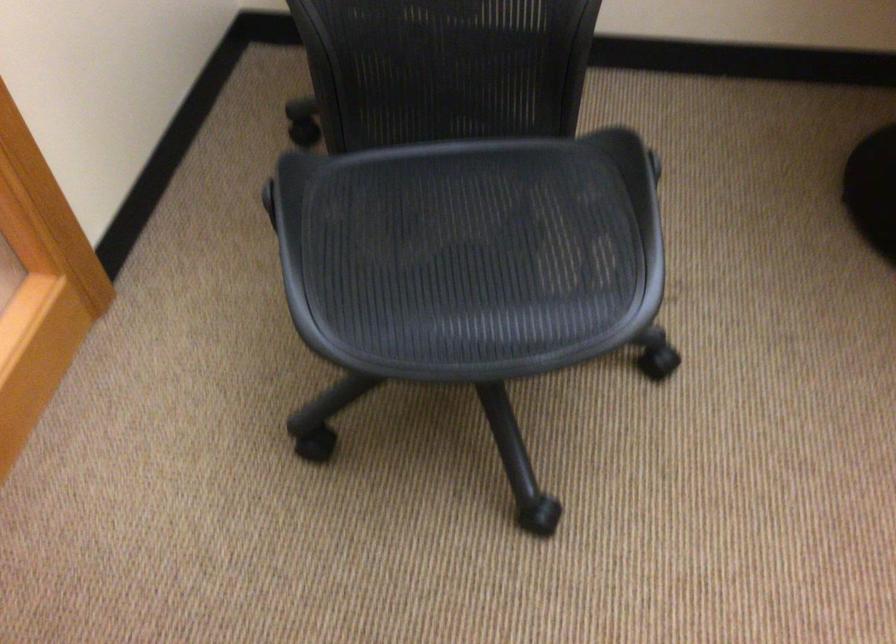
Find where to sit the black chair sitting surface. Please return your answer as a coordinate pair (x, y).

(470, 254)